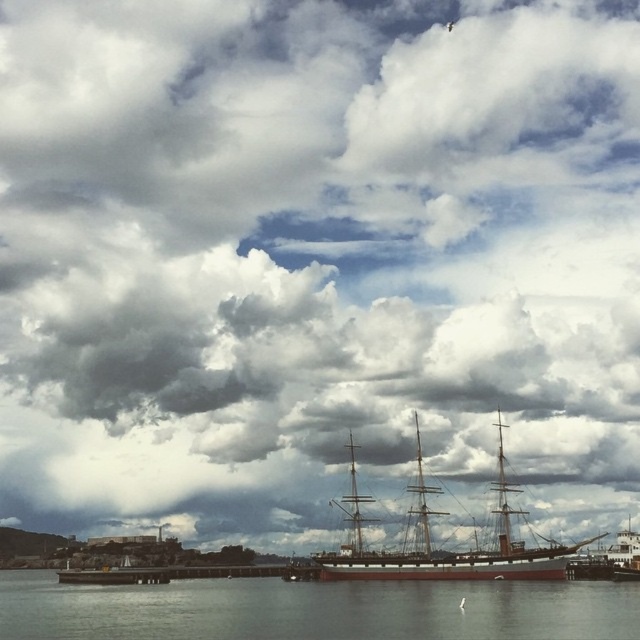
You are standing on the pier and see the clear water at lower center and the wooden ship at center. Which object is located to the left of the other?

The clear water at lower center is located to the left of the wooden ship at center.

You are standing on the pier and looking at the clear water at lower center and the wooden ship at center. Which object is closer to the bottom edge of the image?

The clear water at lower center is closer to the bottom edge of the image because it is located below the wooden ship at center.